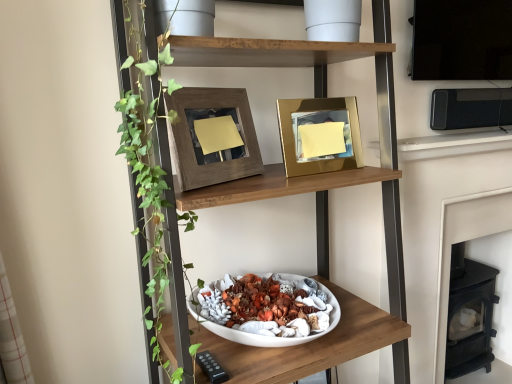
Question: Can you confirm if black plastic microwave at upper right is shorter than gold metallic picture frame at upper center, the first picture frame positioned from the right?

Choices:
 (A) yes
 (B) no

Answer: (A)

Question: Could gold metallic picture frame at upper center, the first picture frame positioned from the right, be considered to be inside black plastic microwave at upper right?

Choices:
 (A) yes
 (B) no

Answer: (B)

Question: Does black plastic microwave at upper right appear on the right side of gold metallic picture frame at upper center, the second picture frame when ordered from left to right?

Choices:
 (A) no
 (B) yes

Answer: (B)

Question: Is black plastic microwave at upper right smaller than gold metallic picture frame at upper center, the second picture frame when ordered from left to right?

Choices:
 (A) yes
 (B) no

Answer: (B)

Question: Is the depth of black plastic microwave at upper right greater than that of gold metallic picture frame at upper center, the second picture frame when ordered from left to right?

Choices:
 (A) yes
 (B) no

Answer: (A)

Question: From the image's perspective, is black plastic microwave at upper right below gold metallic picture frame at upper center, the second picture frame when ordered from left to right?

Choices:
 (A) no
 (B) yes

Answer: (A)

Question: From a real-world perspective, is gold metallic picture frame at upper center, the second picture frame when ordered from left to right, under black cast iron fireplace at lower right?

Choices:
 (A) yes
 (B) no

Answer: (B)

Question: Is black cast iron fireplace at lower right inside gold metallic picture frame at upper center, the first picture frame positioned from the right?

Choices:
 (A) yes
 (B) no

Answer: (B)

Question: Is the position of gold metallic picture frame at upper center, the first picture frame positioned from the right, less distant than that of black cast iron fireplace at lower right?

Choices:
 (A) no
 (B) yes

Answer: (B)

Question: Can you see gold metallic picture frame at upper center, the first picture frame positioned from the right, touching black cast iron fireplace at lower right?

Choices:
 (A) yes
 (B) no

Answer: (B)

Question: From a real-world perspective, is gold metallic picture frame at upper center, the second picture frame when ordered from left to right, located higher than black cast iron fireplace at lower right?

Choices:
 (A) yes
 (B) no

Answer: (A)

Question: Does gold metallic picture frame at upper center, the first picture frame positioned from the right, have a lesser width compared to black cast iron fireplace at lower right?

Choices:
 (A) no
 (B) yes

Answer: (B)

Question: From the image's perspective, does gold metallic picture frame at upper center, the second picture frame when ordered from left to right, appear higher than white matte bowl at center, which is counted as the first shelf, starting from the bottom?

Choices:
 (A) no
 (B) yes

Answer: (B)